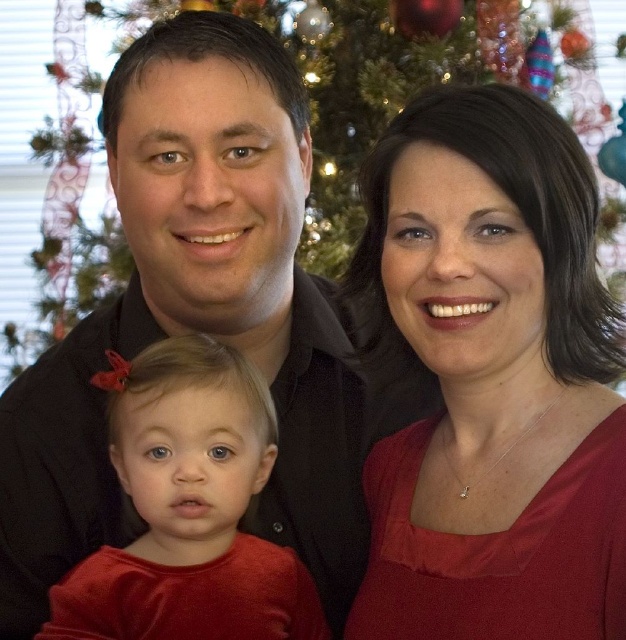
Can you confirm if matte black shirt at center is wider than green textured christmas tree at center?

Yes, matte black shirt at center is wider than green textured christmas tree at center.

Identify the location of matte black shirt at center. The image size is (626, 640). (195, 316).

Is point (354, 586) behind point (456, 67)?

No, it is not.

Identify the location of matte black shirt at center. This screenshot has height=640, width=626. (195, 316).

Between matte red dress at center and shiny red dress at lower left, which one appears on the left side from the viewer's perspective?

shiny red dress at lower left

Is matte red dress at center positioned before shiny red dress at lower left?

Yes, matte red dress at center is closer to the viewer.

Which is behind, point (466, 156) or point (130, 408)?

The point (130, 408) is behind.

You are a GUI agent. You are given a task and a screenshot of the screen. Output one action in this format:
    pyautogui.click(x=<x>, y=<y>)
    Task: Click on the matte red dress at center
    The width and height of the screenshot is (626, 640).
    Given the screenshot: What is the action you would take?
    pyautogui.click(x=493, y=378)

Does point (541, 316) come in front of point (356, 204)?

Yes.

Is point (406, 252) positioned behind point (326, 104)?

No, (406, 252) is in front of (326, 104).

Identify the location of matte red dress at center. The width and height of the screenshot is (626, 640). (493, 378).